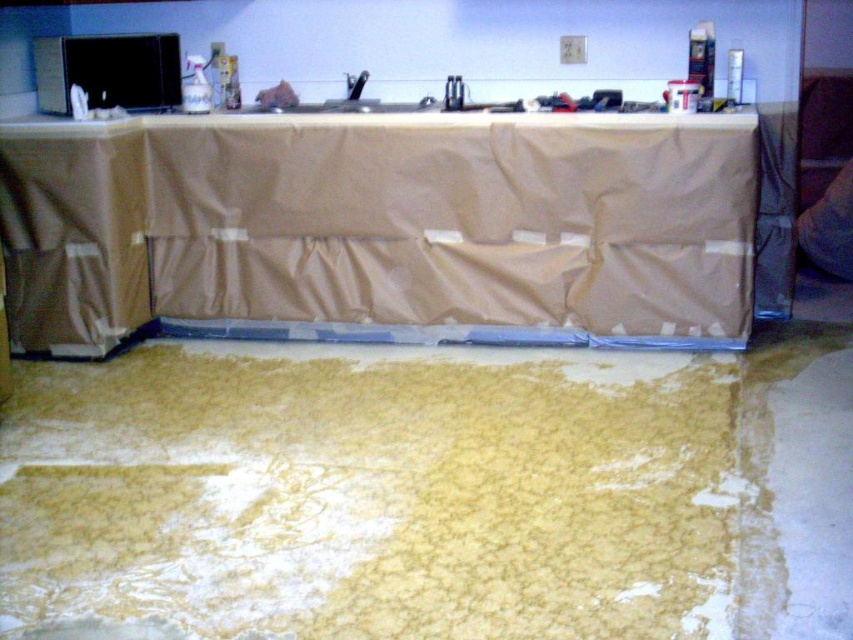
Question: Which point is closer to the camera taking this photo?

Choices:
 (A) (601, 529)
 (B) (296, 298)

Answer: (A)

Question: Can you confirm if yellow crumbly food at lower center is positioned to the left of tan fabric-covered table at center?

Choices:
 (A) no
 (B) yes

Answer: (B)

Question: Where is yellow crumbly food at lower center located in relation to tan fabric-covered table at center in the image?

Choices:
 (A) below
 (B) above

Answer: (A)

Question: In this image, where is yellow crumbly food at lower center located relative to tan fabric-covered table at center?

Choices:
 (A) below
 (B) above

Answer: (A)